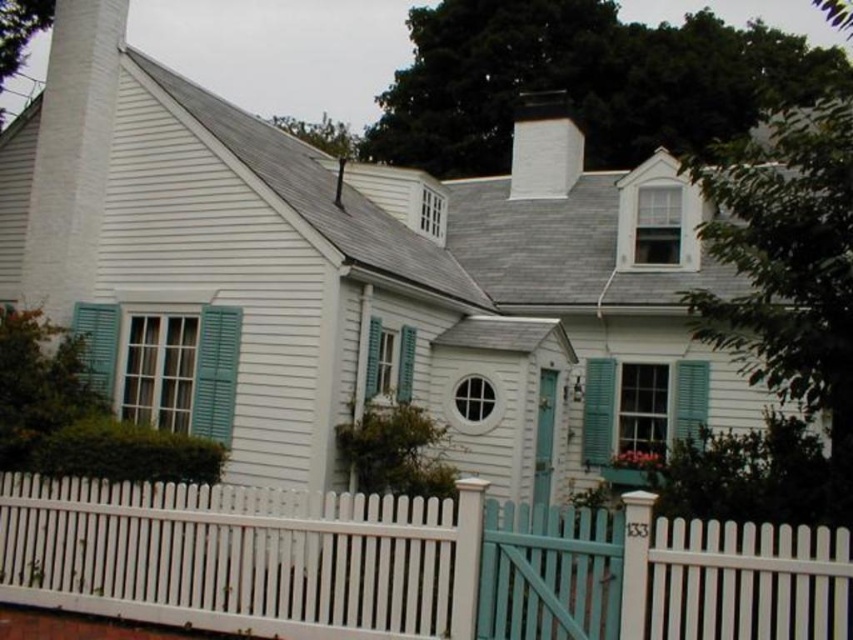
Question: Is teal painted wood shutter at left bigger than teal matte shutter at center?

Choices:
 (A) no
 (B) yes

Answer: (B)

Question: Which of the following is the closest to the observer?

Choices:
 (A) (602, 387)
 (B) (163, 371)
 (C) (422, 516)

Answer: (C)

Question: Can you confirm if white picket fence at lower center is bigger than green matte shutter at center?

Choices:
 (A) yes
 (B) no

Answer: (A)

Question: Which of the following is the closest to the observer?

Choices:
 (A) teal matte shutter at center
 (B) green matte shutter at center
 (C) teal painted wood shutter at left

Answer: (C)

Question: Is white picket fence at lower center smaller than green matte shutter at center?

Choices:
 (A) no
 (B) yes

Answer: (A)

Question: Which point is farther to the camera?

Choices:
 (A) teal painted wood shutter at left
 (B) white picket fence at lower center

Answer: (A)